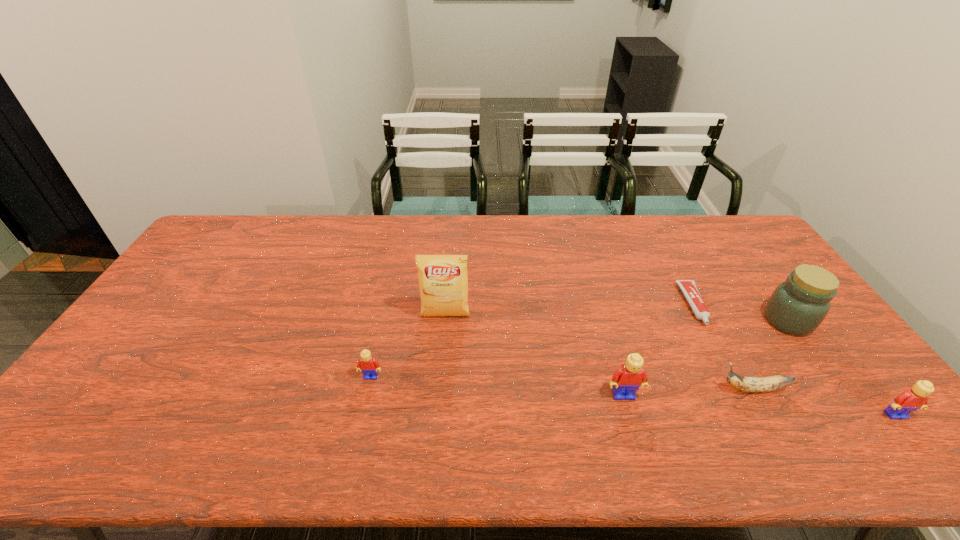
Given the evenly spaced Legos in the image, where should an extra Lego be added on the left to preserve the spacing? Please point to a vacant space. Please provide its 2D coordinates. Your answer should be formatted as a tuple, i.e. [(x, y)], where the tuple contains the x and y coordinates of a point satisfying the conditions above.

[(137, 359)]